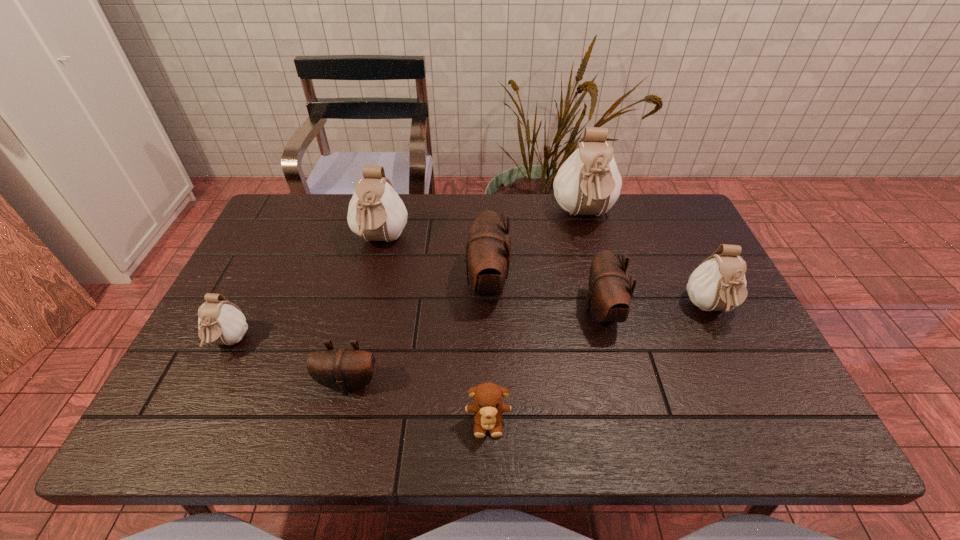
This screenshot has height=540, width=960. Identify the location of the biggest white pouch. (588, 183).

Identify the location of the tallest object. tap(588, 183).

The image size is (960, 540). In order to click on the third smallest white pouch in this screenshot , I will do `click(376, 212)`.

Identify the location of the fourth pouch from left to right. (488, 247).

At what (x,y) coordinates should I click in order to perform the action: click on the second brown pouch from left to right. Please return your answer as a coordinate pair (x, y). This screenshot has height=540, width=960. Looking at the image, I should click on (488, 247).

This screenshot has height=540, width=960. Find the location of `the rightmost object`. the rightmost object is located at coordinates (718, 284).

Identify the location of the rightmost pouch. This screenshot has width=960, height=540. (718, 284).

Locate an element on the screen. This screenshot has height=540, width=960. the second smallest brown pouch is located at coordinates (609, 296).

This screenshot has width=960, height=540. I want to click on the leftmost pouch, so click(220, 321).

Locate an element on the screen. the leftmost object is located at coordinates (220, 321).